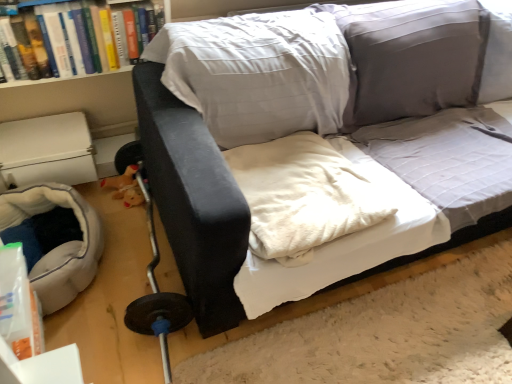
Question: Considering the relative sizes of hardcover book at upper left and velvet black couch at center in the image provided, is hardcover book at upper left thinner than velvet black couch at center?

Choices:
 (A) no
 (B) yes

Answer: (B)

Question: Can you confirm if hardcover book at upper left is taller than velvet black couch at center?

Choices:
 (A) yes
 (B) no

Answer: (B)

Question: Can you confirm if hardcover book at upper left is smaller than velvet black couch at center?

Choices:
 (A) yes
 (B) no

Answer: (A)

Question: From a real-world perspective, is hardcover book at upper left beneath velvet black couch at center?

Choices:
 (A) yes
 (B) no

Answer: (B)

Question: From the image's perspective, does hardcover book at upper left appear higher than velvet black couch at center?

Choices:
 (A) yes
 (B) no

Answer: (A)

Question: From the image's perspective, is soft gray fabric bean bag at lower left located above or below white soft blanket at center?

Choices:
 (A) above
 (B) below

Answer: (B)

Question: Considering their positions, is soft gray fabric bean bag at lower left located in front of or behind white soft blanket at center?

Choices:
 (A) behind
 (B) front

Answer: (A)

Question: Based on their sizes in the image, would you say soft gray fabric bean bag at lower left is bigger or smaller than white soft blanket at center?

Choices:
 (A) small
 (B) big

Answer: (B)

Question: Is point (66, 244) positioned closer to the camera than point (251, 185)?

Choices:
 (A) farther
 (B) closer

Answer: (A)

Question: Relative to hardcover book at upper left, is white soft blanket at center in front or behind?

Choices:
 (A) front
 (B) behind

Answer: (A)

Question: From a real-world perspective, relative to hardcover book at upper left, is white soft blanket at center vertically above or below?

Choices:
 (A) below
 (B) above

Answer: (A)

Question: In terms of size, does white soft blanket at center appear bigger or smaller than hardcover book at upper left?

Choices:
 (A) big
 (B) small

Answer: (A)

Question: Is point (292, 253) positioned closer to the camera than point (81, 62)?

Choices:
 (A) farther
 (B) closer

Answer: (B)

Question: Considering the relative positions of soft gray fabric bean bag at lower left and hardcover book at upper left in the image provided, is soft gray fabric bean bag at lower left to the left or to the right of hardcover book at upper left?

Choices:
 (A) right
 (B) left

Answer: (B)

Question: Does point (74, 269) appear closer or farther from the camera than point (58, 49)?

Choices:
 (A) closer
 (B) farther

Answer: (A)